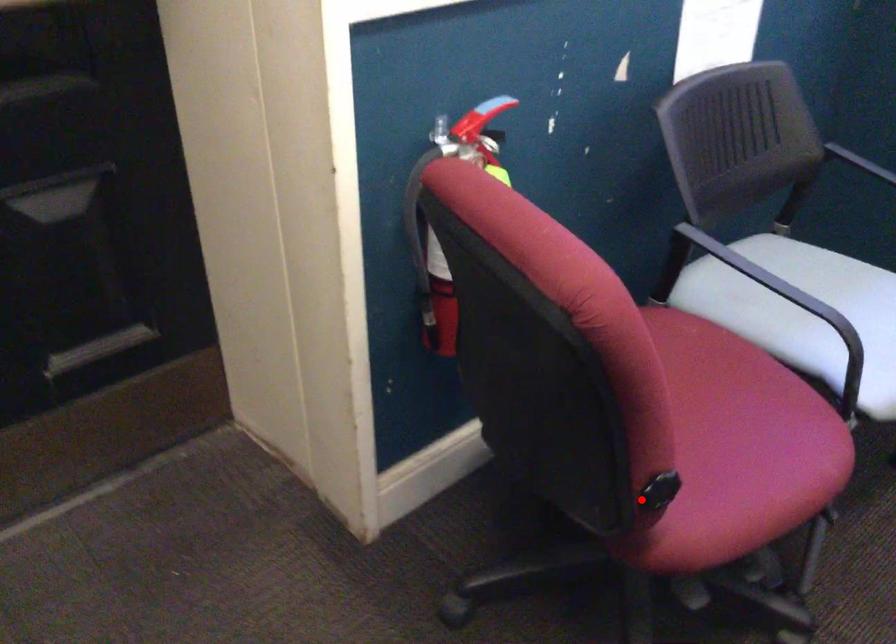
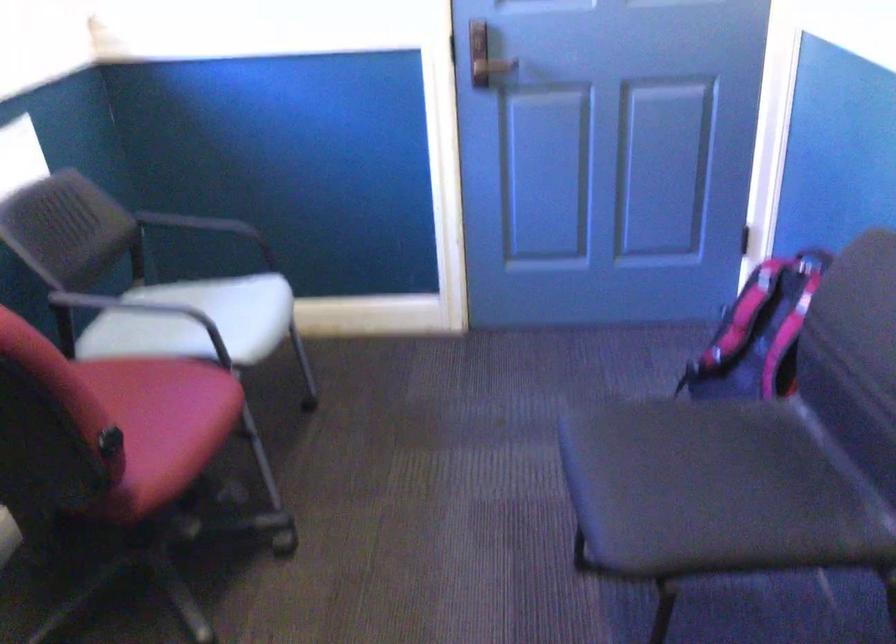
Find the pixel in the second image that matches the highlighted location in the first image.

(109, 442)